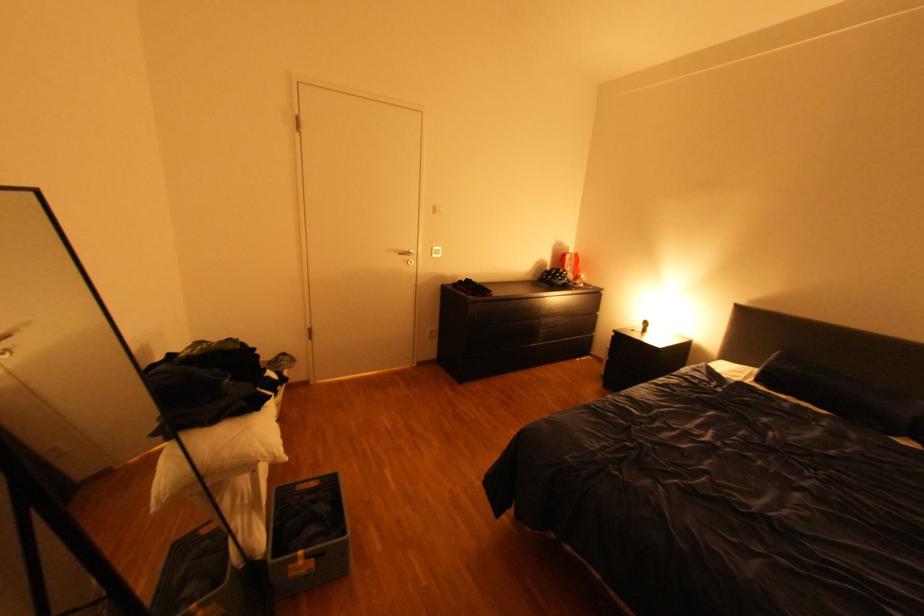
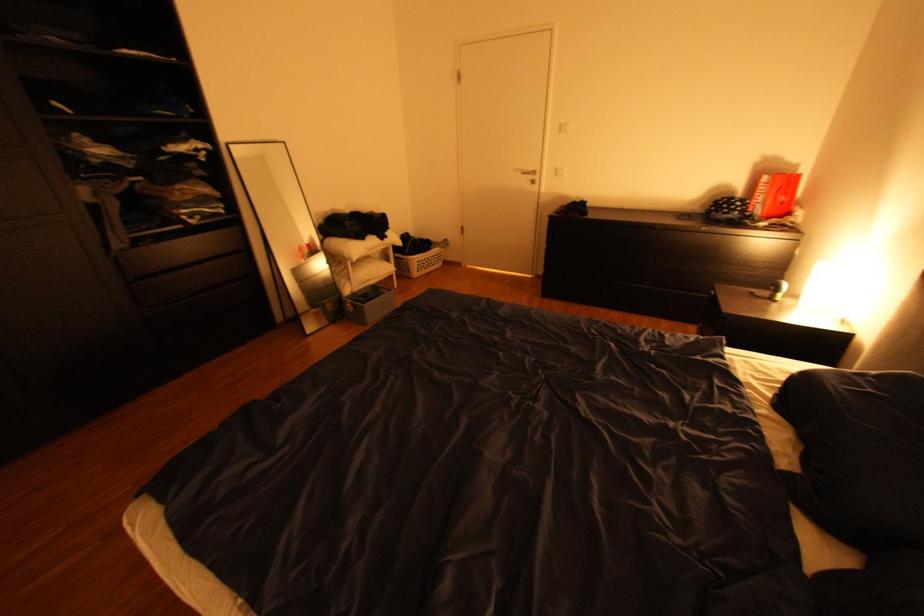
Locate, in the second image, the point that corresponds to [576,276] in the first image.

(748, 208)